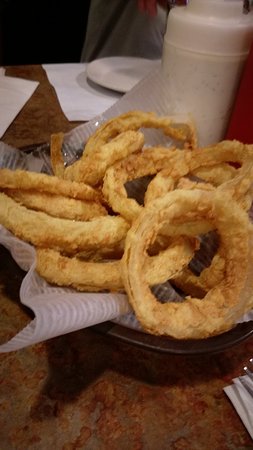
At what (x,y) coordinates should I click in order to perform the action: click on napkin. Please return your answer as a coordinate pair (x, y). The height and width of the screenshot is (450, 253). Looking at the image, I should click on (238, 397).